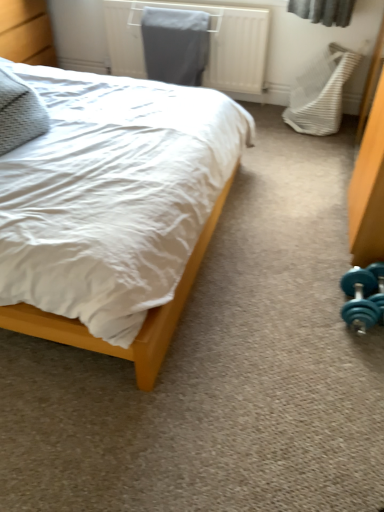
I want to click on free area behind teal rubber dumbbell at lower right, so click(320, 265).